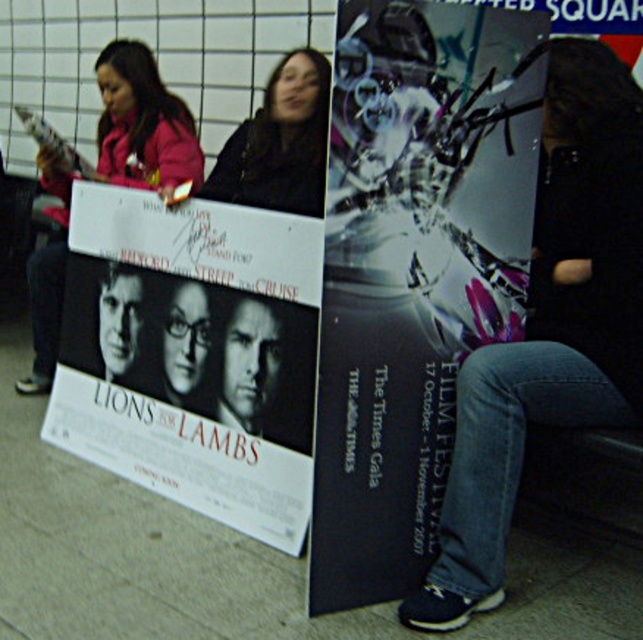
Does metallic silver poster at center appear under white paper poster at center?

No, metallic silver poster at center is not below white paper poster at center.

Between point (372, 292) and point (84, 349), which one is positioned behind?

The point (84, 349) is behind.

The image size is (643, 640). I want to click on metallic silver poster at center, so click(x=413, y=269).

Is point (536, 172) behind point (150, 156)?

No.

Which is above, metallic silver poster at center or matte pink jacket at upper left?

matte pink jacket at upper left

Locate an element on the screen. metallic silver poster at center is located at coordinates (413, 269).

Looking at this image, does white paper poster at center have a larger size compared to denim jeans at lower right?

Correct, white paper poster at center is larger in size than denim jeans at lower right.

Can you confirm if white paper poster at center is wider than denim jeans at lower right?

Yes, white paper poster at center is wider than denim jeans at lower right.

Which is in front, point (237, 432) or point (619, 198)?

Point (619, 198) is more forward.

What are the coordinates of `white paper poster at center` in the screenshot? It's located at (192, 355).